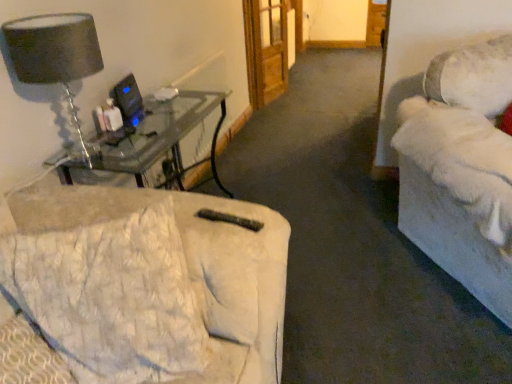
Question: Considering the relative sizes of matte glass table lamp at upper left and wooden door at center in the image provided, is matte glass table lamp at upper left shorter than wooden door at center?

Choices:
 (A) yes
 (B) no

Answer: (A)

Question: Is matte glass table lamp at upper left facing away from wooden door at center?

Choices:
 (A) no
 (B) yes

Answer: (A)

Question: Can you confirm if matte glass table lamp at upper left is wider than wooden door at center?

Choices:
 (A) yes
 (B) no

Answer: (A)

Question: Does matte glass table lamp at upper left come in front of wooden door at center?

Choices:
 (A) yes
 (B) no

Answer: (A)

Question: Is matte glass table lamp at upper left bigger than wooden door at center?

Choices:
 (A) yes
 (B) no

Answer: (B)

Question: From the image's perspective, is matte glass table lamp at upper left below wooden door at center?

Choices:
 (A) yes
 (B) no

Answer: (A)

Question: Does white plush couch at right, which is the first studio couch in right-to-left order, have a larger size compared to matte glass table lamp at upper left?

Choices:
 (A) no
 (B) yes

Answer: (B)

Question: From a real-world perspective, is white plush couch at right, which is the first studio couch in right-to-left order, located higher than matte glass table lamp at upper left?

Choices:
 (A) no
 (B) yes

Answer: (A)

Question: Considering the relative sizes of white plush couch at right, the second studio couch from the left, and matte glass table lamp at upper left in the image provided, is white plush couch at right, the second studio couch from the left, shorter than matte glass table lamp at upper left?

Choices:
 (A) yes
 (B) no

Answer: (B)

Question: Can you confirm if white plush couch at right, which is the first studio couch in right-to-left order, is thinner than matte glass table lamp at upper left?

Choices:
 (A) yes
 (B) no

Answer: (B)

Question: Is white plush couch at right, the second studio couch from the left, beside matte glass table lamp at upper left?

Choices:
 (A) yes
 (B) no

Answer: (B)

Question: Does white plush couch at right, the second studio couch from the left, come behind matte glass table lamp at upper left?

Choices:
 (A) yes
 (B) no

Answer: (B)

Question: Is white plush couch at right, which is the first studio couch in right-to-left order, located within black plastic computer monitor at upper left?

Choices:
 (A) yes
 (B) no

Answer: (B)